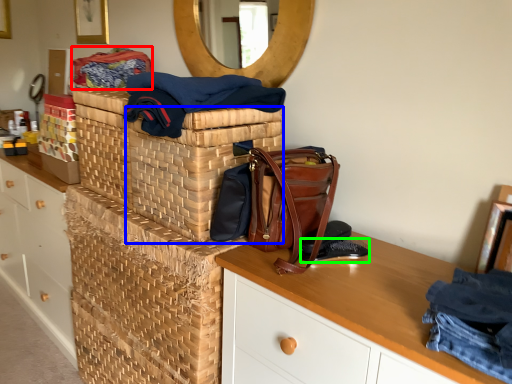
Question: Which object is positioned farthest from material (highlighted by a red box)? Select from basket (highlighted by a blue box) and shoe (highlighted by a green box).

Choices:
 (A) basket
 (B) shoe

Answer: (B)